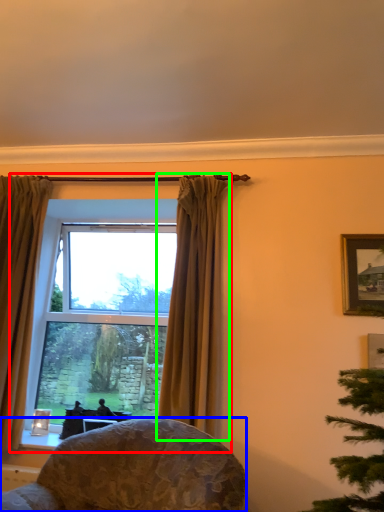
Question: Which object is positioned closest to window (highlighted by a red box)? Select from chair (highlighted by a blue box) and curtain (highlighted by a green box).

Choices:
 (A) chair
 (B) curtain

Answer: (A)